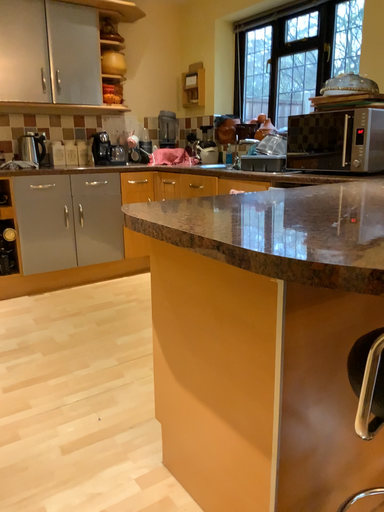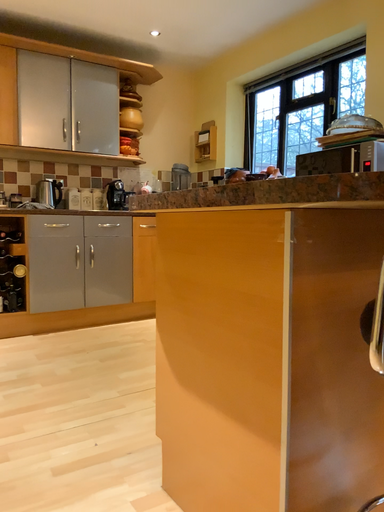
Question: How did the camera likely rotate when shooting the video?

Choices:
 (A) rotated downward
 (B) rotated upward

Answer: (B)